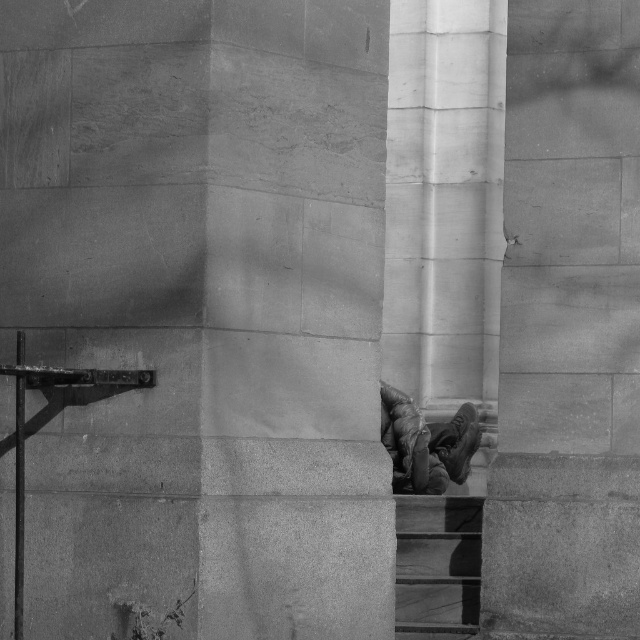
You are standing in the scene and want to walk towards the smooth stone pillar at center and the smooth concrete stairs at lower right. Which one will you reach first?

You will reach the smooth stone pillar at center first because it is closer to you than the smooth concrete stairs at lower right.

You are a photographer standing in front of the smooth stone pillar at center and the leather boots at center. You want to take a photo that includes both objects but ensure the pillar doesn not block the boots. Can you position yourself so that the pillar is to the side and the boots are fully visible? Explain your reasoning.

The smooth stone pillar at center might be wider than leather boots at center. If the pillar is wider, positioning yourself so it is to the side could still allow the boots to be fully visible as long as there is enough space between them. However, if the pillar is significantly wider, it might partially obscure the boots depending on their exact placement.

You are standing on the smooth concrete stairs at lower right and want to reach the top of the leather boots at center. Is the stairs tall enough for you to reach the boots?

The smooth concrete stairs at lower right is shorter than the leather boots at center, so the stairs are not tall enough to reach the boots.